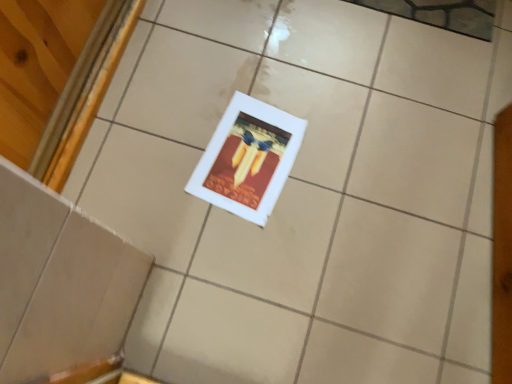
You are a GUI agent. You are given a task and a screenshot of the screen. Output one action in this format:
    pyautogui.click(x=<x>, y=<y>)
    Task: Click on the free location to the right of white matte picture frame at center
    The image size is (512, 384).
    Given the screenshot: What is the action you would take?
    pyautogui.click(x=343, y=174)